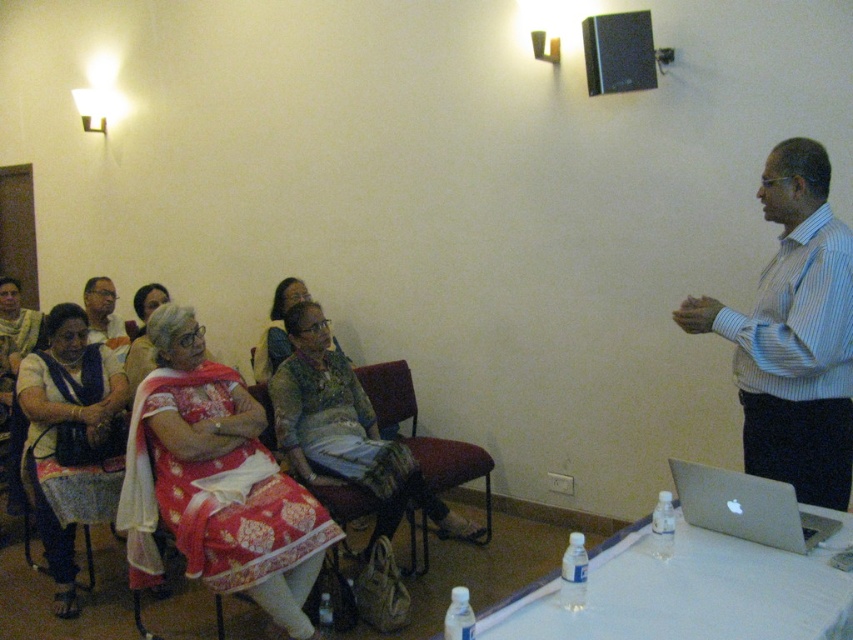
You are sitting in the audience at a presentation and want to ask a question. The presenter is wearing a blue striped shirt at upper right. Where should you look to address the presenter?

You should look towards the upper right where the blue striped shirt at upper right is located since that is where the presenter is standing.

You are sitting at the back of the room and want to see both the blue striped shirt at upper right and the matte white saree at center left. Which one will appear larger to you?

The blue striped shirt at upper right will appear larger because it is closer to you than the matte white saree at center left.

You are a photographer taking a portrait of the matte white saree at center left and the silver metallic laptop at lower right. Which object should you focus on first if you want to capture both in a single frame without moving the camera?

You should focus on the matte white saree at center left first because it is much taller than the silver metallic laptop at lower right, so it will require more attention in the frame.